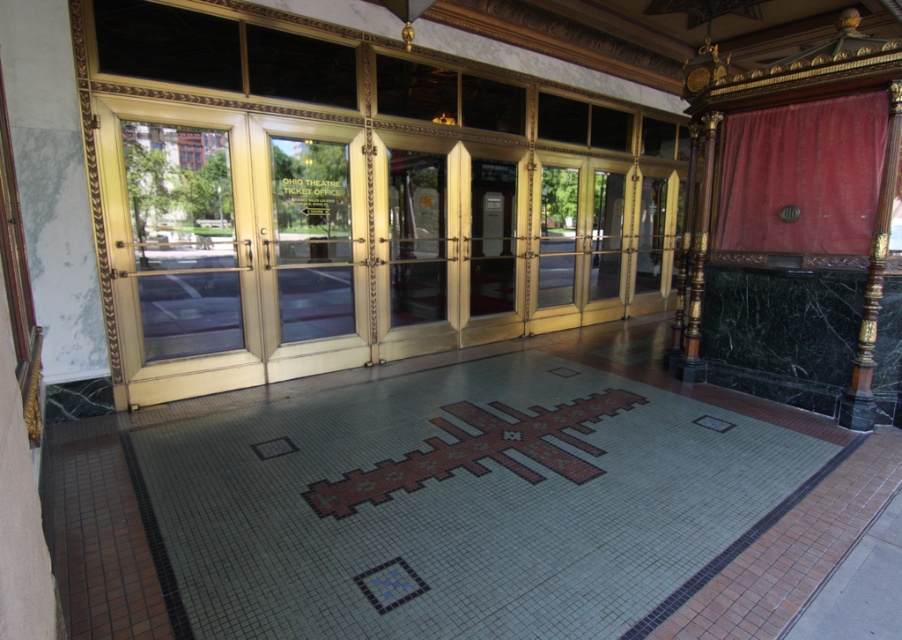
Describe the element at coordinates (347, 196) in the screenshot. This screenshot has height=640, width=902. I see `gold/gilded doors at center` at that location.

Which is behind, point (383, 276) or point (850, 129)?

The point (383, 276) is more distant.

Find the location of a particular element. gold/gilded doors at center is located at coordinates (347, 196).